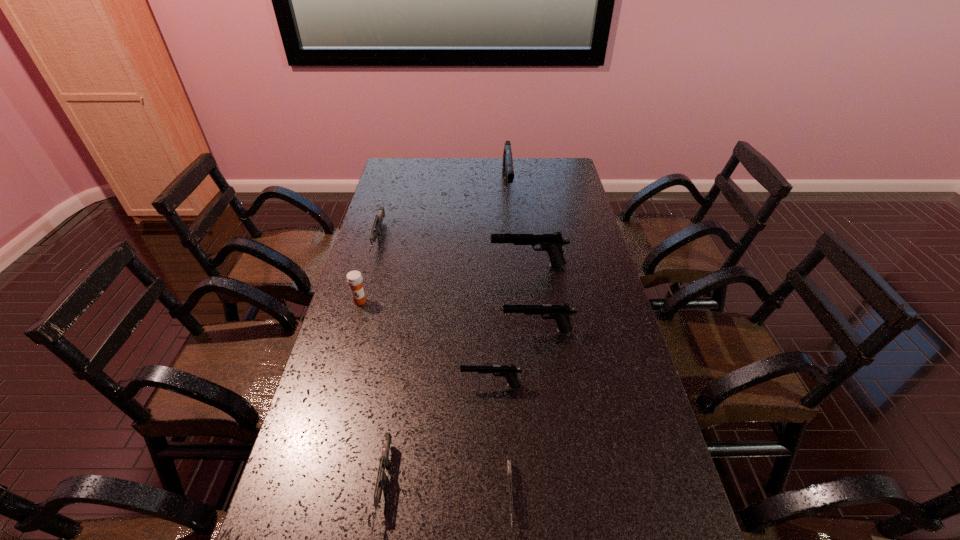
Where is `vacant space positioned 0.380m on the label side of the medicine`? vacant space positioned 0.380m on the label side of the medicine is located at coordinates (328, 413).

Where is `free location located 0.230m at the aiming end of the sixth farthest object`? This screenshot has width=960, height=540. free location located 0.230m at the aiming end of the sixth farthest object is located at coordinates (376, 384).

Where is `vacant space located at the aiming end of the sixth farthest object`? This screenshot has height=540, width=960. vacant space located at the aiming end of the sixth farthest object is located at coordinates (318, 384).

Image resolution: width=960 pixels, height=540 pixels. What are the coordinates of `free space located at the aiming end of the sixth farthest object` in the screenshot? It's located at click(344, 384).

The image size is (960, 540). Find the location of `free region located 0.350m aimed along the barrel of the leftmost gun`. free region located 0.350m aimed along the barrel of the leftmost gun is located at coordinates click(x=350, y=338).

This screenshot has height=540, width=960. In order to click on object at the far edge in this screenshot , I will do `click(507, 169)`.

Where is `medicine that is at the left edge`? The image size is (960, 540). medicine that is at the left edge is located at coordinates (354, 278).

You are a GUI agent. You are given a task and a screenshot of the screen. Output one action in this format:
    pyautogui.click(x=<x>, y=<y>)
    Task: Click on the gun present at the left edge
    Image resolution: width=960 pixels, height=540 pixels.
    Given the screenshot: What is the action you would take?
    pyautogui.click(x=377, y=225)

In the image, there is a desktop. In order to click on vacant space at the far edge in this screenshot , I will do `click(485, 158)`.

Find the location of a particular element. The width and height of the screenshot is (960, 540). blank space at the left edge of the desktop is located at coordinates (342, 503).